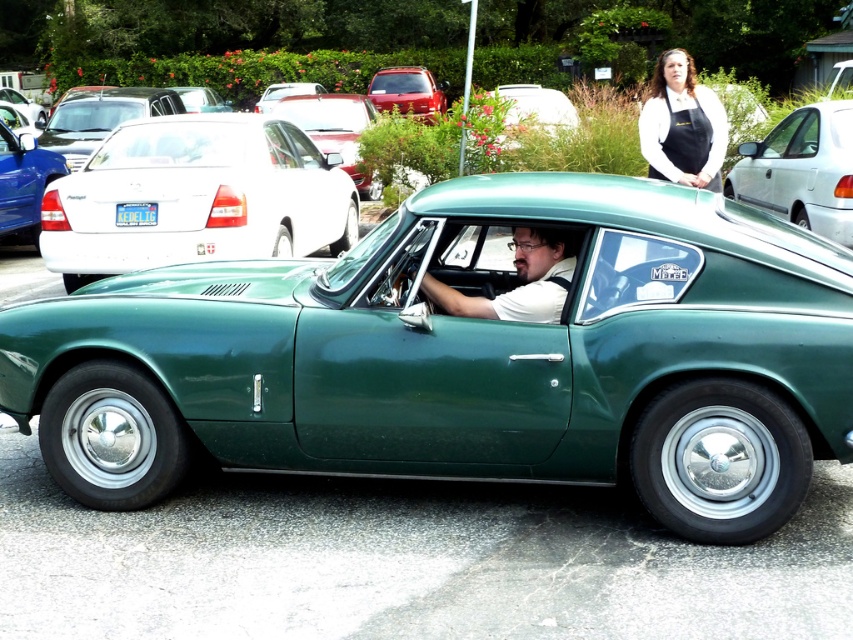
Question: Based on their relative distances, which object is nearer to the shiny white sedan at upper left?

Choices:
 (A) green matte license plate at center
 (B) green metallic car at center
 (C) matte green car at left
 (D) matte green car at center

Answer: (C)

Question: Which object is farther from the camera taking this photo?

Choices:
 (A) green matte license plate at center
 (B) green metallic car at center

Answer: (A)

Question: Can you confirm if shiny white sedan at upper left is positioned below matte red car at center?

Choices:
 (A) no
 (B) yes

Answer: (B)

Question: Is white glossy sedan at upper right above green matte car at center?

Choices:
 (A) no
 (B) yes

Answer: (A)

Question: Is matte red car at center wider than green matte license plate at center?

Choices:
 (A) yes
 (B) no

Answer: (A)

Question: Which object appears farthest from the camera in this image?

Choices:
 (A) shiny white sedan at upper left
 (B) green metallic car at center

Answer: (A)